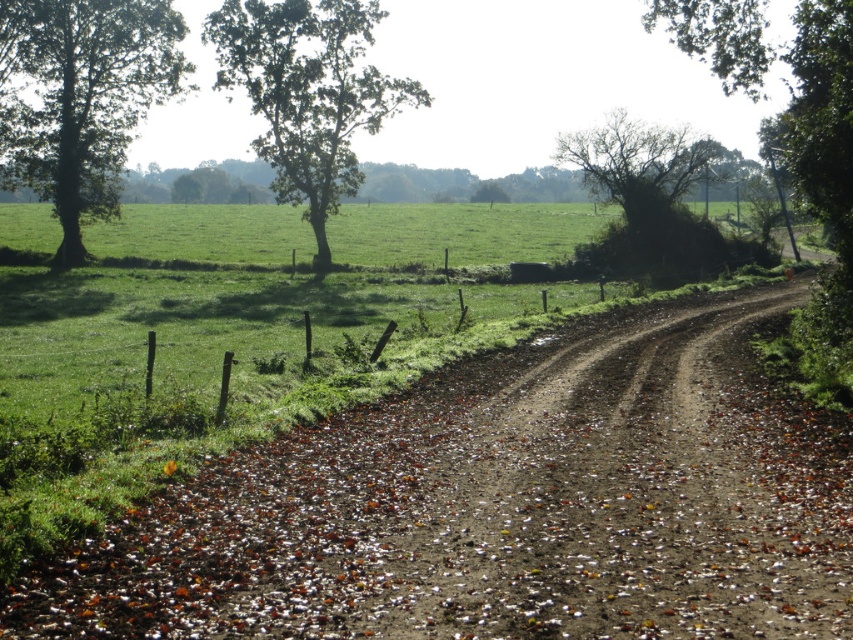
Question: Can you confirm if brown dirt track at center is bigger than green leafy tree at left?

Choices:
 (A) yes
 (B) no

Answer: (B)

Question: Which point appears farthest from the camera in this image?

Choices:
 (A) (495, 593)
 (B) (305, 106)
 (C) (611, 136)
 (D) (126, 301)

Answer: (C)

Question: In this image, where is green leafy tree at upper left located relative to bare branches at upper right?

Choices:
 (A) above
 (B) below

Answer: (A)

Question: Is brown dirt track at center wider than green grass at center?

Choices:
 (A) no
 (B) yes

Answer: (A)

Question: Which point is closer to the camera?

Choices:
 (A) (642, 131)
 (B) (392, 561)
 (C) (259, 33)
 (D) (196, 356)

Answer: (B)

Question: Which point is farther to the camera?

Choices:
 (A) (405, 97)
 (B) (27, 301)

Answer: (A)